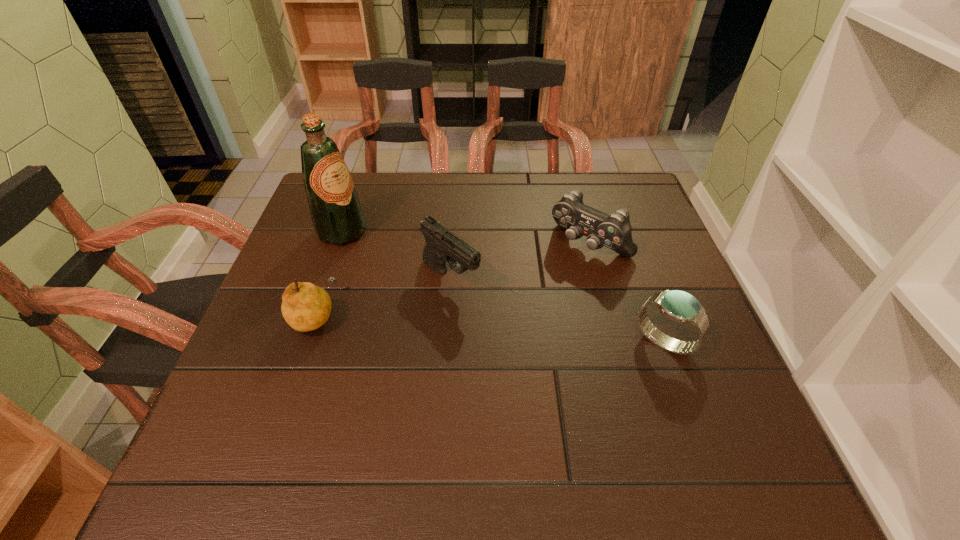
Find the location of a particular element. The height and width of the screenshot is (540, 960). free point located 0.110m on the surface of the control with buttons is located at coordinates (542, 289).

Where is `vacant space located on the surface of the control with buttons`? vacant space located on the surface of the control with buttons is located at coordinates (545, 287).

Find the location of a particular element. The height and width of the screenshot is (540, 960). free space located 0.200m on the surface of the control with buttons is located at coordinates (519, 313).

Find the location of a particular element. The width and height of the screenshot is (960, 540). vacant region located 0.220m at the barrel of the pistol is located at coordinates (542, 357).

Where is `free space located 0.150m at the barrel of the pistol`? free space located 0.150m at the barrel of the pistol is located at coordinates (517, 336).

This screenshot has height=540, width=960. Find the location of `vacant space situated at the barrel of the pistol`. vacant space situated at the barrel of the pistol is located at coordinates (494, 316).

I want to click on object that is at the far edge, so click(337, 216).

Image resolution: width=960 pixels, height=540 pixels. What are the coordinates of `pear that is at the left edge` in the screenshot? It's located at (305, 307).

Where is `olive oil present at the left edge`? olive oil present at the left edge is located at coordinates (337, 216).

The height and width of the screenshot is (540, 960). Find the location of `watch that is at the right edge`. watch that is at the right edge is located at coordinates (679, 306).